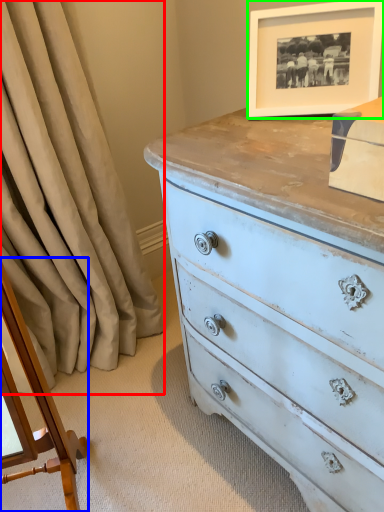
Question: Which object is the closest to the curtain (highlighted by a red box)? Choose among these: changing table (highlighted by a blue box) or picture frame (highlighted by a green box).

Choices:
 (A) changing table
 (B) picture frame

Answer: (A)